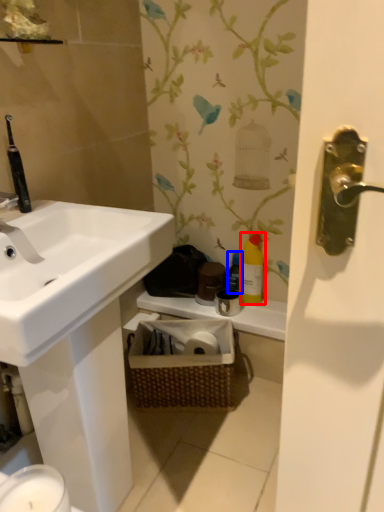
Question: Which object is further to the camera taking this photo, cleaning product (highlighted by a red box) or bottle (highlighted by a blue box)?

Choices:
 (A) cleaning product
 (B) bottle

Answer: (B)